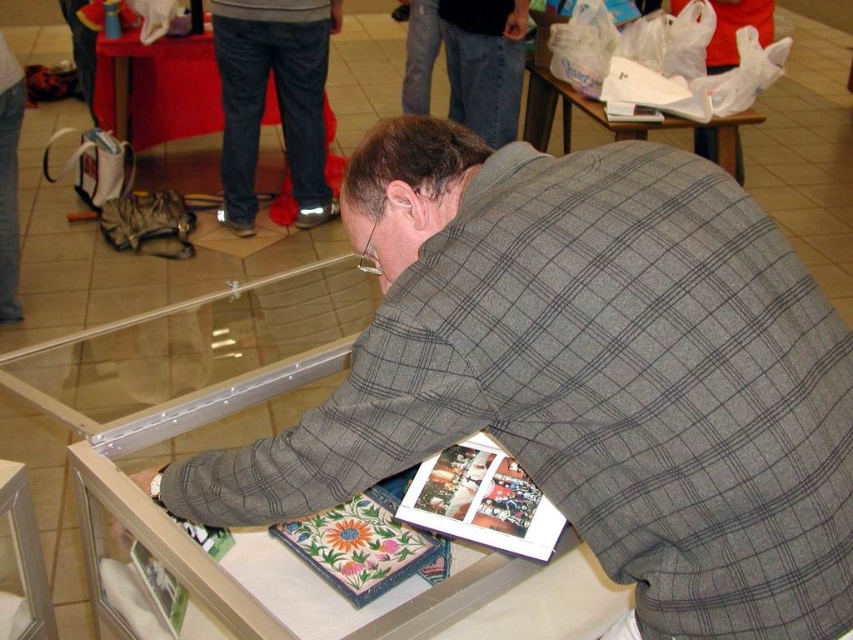
Which of these two, red fabric table at upper left or floral fabric magazine at lower center, stands taller?

Standing taller between the two is red fabric table at upper left.

Between red fabric table at upper left and floral fabric magazine at lower center, which one appears on the left side from the viewer's perspective?

red fabric table at upper left is more to the left.

Locate an element on the screen. Image resolution: width=853 pixels, height=640 pixels. red fabric table at upper left is located at coordinates (160, 88).

Does floral fabric magazine at lower center have a smaller size compared to white plastic bag at upper center?

Indeed, floral fabric magazine at lower center has a smaller size compared to white plastic bag at upper center.

Is floral fabric magazine at lower center to the right of white plastic bag at upper center from the viewer's perspective?

Incorrect, floral fabric magazine at lower center is not on the right side of white plastic bag at upper center.

Who is more forward, (426, 561) or (602, 125)?

Positioned in front is point (426, 561).

This screenshot has width=853, height=640. I want to click on floral fabric magazine at lower center, so click(363, 544).

How far apart are floral fabric magazine at lower center and printed paper magazine at lower left?

A distance of 8.12 inches exists between floral fabric magazine at lower center and printed paper magazine at lower left.

You are a GUI agent. You are given a task and a screenshot of the screen. Output one action in this format:
    pyautogui.click(x=<x>, y=<y>)
    Task: Click on the floral fabric magazine at lower center
    The image size is (853, 640).
    Given the screenshot: What is the action you would take?
    pyautogui.click(x=363, y=544)

Find the location of a particular element. The width and height of the screenshot is (853, 640). floral fabric magazine at lower center is located at coordinates (363, 544).